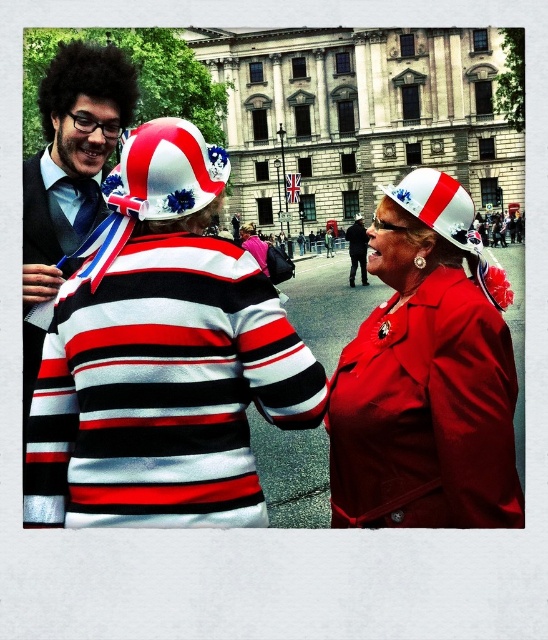
Question: Which of the following is the closest to the observer?

Choices:
 (A) matte fabric hat at upper center
 (B) matte red coat at center
 (C) dark blue suit at center
 (D) red fabric flag at center

Answer: (B)

Question: Does matte red coat at center have a smaller size compared to white and red fabric hat at center?

Choices:
 (A) no
 (B) yes

Answer: (A)

Question: Does matte fabric hat at upper center lie in front of red fabric flag at center?

Choices:
 (A) yes
 (B) no

Answer: (A)

Question: Estimate the real-world distances between objects in this image. Which object is closer to the white and red fabric hat at center?

Choices:
 (A) white and red striped hat with floral decorations at center
 (B) striped fabric sweater at center
 (C) white fabric hat at upper center

Answer: (A)

Question: Among these objects, which one is farthest from the camera?

Choices:
 (A) matte red coat at center
 (B) striped fabric sweater at center
 (C) white and red fabric hat at center

Answer: (B)

Question: Is matte fabric hat at upper center thinner than dark blue suit at center?

Choices:
 (A) yes
 (B) no

Answer: (B)